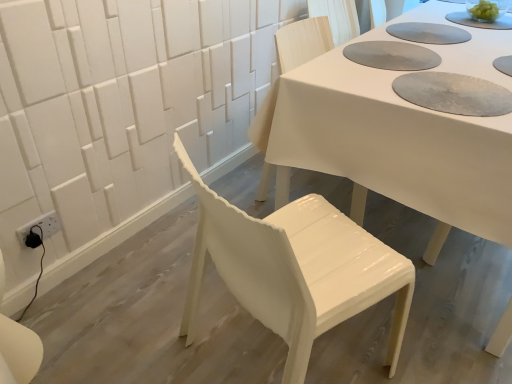
Question: In which direction should I rotate to look at white glossy chair at center, the 1th chair viewed from the back?

Choices:
 (A) right
 (B) left

Answer: (A)

Question: Is textured gray paper plate at upper center positioned far away from white glossy chair at center, the second chair positioned from the back?

Choices:
 (A) no
 (B) yes

Answer: (A)

Question: Can you confirm if textured gray paper plate at upper center is thinner than white glossy chair at center, the second chair positioned from the back?

Choices:
 (A) no
 (B) yes

Answer: (B)

Question: From the image's perspective, would you say textured gray paper plate at upper center is shown under white glossy chair at center, the second chair positioned from the back?

Choices:
 (A) yes
 (B) no

Answer: (B)

Question: Considering the relative positions of textured gray paper plate at upper center and white glossy chair at center, which ranks as the first chair in front-to-back order, in the image provided, is textured gray paper plate at upper center behind white glossy chair at center, which ranks as the first chair in front-to-back order,?

Choices:
 (A) no
 (B) yes

Answer: (B)

Question: Can you confirm if textured gray paper plate at upper center is wider than white glossy chair at center, which ranks as the first chair in front-to-back order?

Choices:
 (A) no
 (B) yes

Answer: (A)

Question: Is textured gray paper plate at upper center directly adjacent to white glossy chair at center, the second chair positioned from the back?

Choices:
 (A) no
 (B) yes

Answer: (A)

Question: From the image's perspective, does white glossy chair at center, the second chair positioned from the back, appear higher than textured gray paper plate at upper center?

Choices:
 (A) yes
 (B) no

Answer: (B)

Question: From the image's perspective, does white glossy chair at center, which ranks as the first chair in front-to-back order, appear lower than textured gray paper plate at upper center?

Choices:
 (A) no
 (B) yes

Answer: (B)

Question: Can you confirm if white glossy chair at center, which ranks as the first chair in front-to-back order, is shorter than textured gray paper plate at upper center?

Choices:
 (A) no
 (B) yes

Answer: (A)

Question: Is textured gray paper plate at upper center inside white glossy chair at center, which ranks as the first chair in front-to-back order?

Choices:
 (A) yes
 (B) no

Answer: (B)

Question: Is white glossy chair at center, the second chair positioned from the back, wider than textured gray paper plate at upper center?

Choices:
 (A) no
 (B) yes

Answer: (B)

Question: Could you tell me if white glossy chair at center, the second chair positioned from the back, is turned towards textured gray paper plate at upper center?

Choices:
 (A) no
 (B) yes

Answer: (A)

Question: Is white glossy chair at center, the second chair positioned from the back, located within white glossy chair at center, the 1th chair viewed from the back?

Choices:
 (A) no
 (B) yes

Answer: (A)